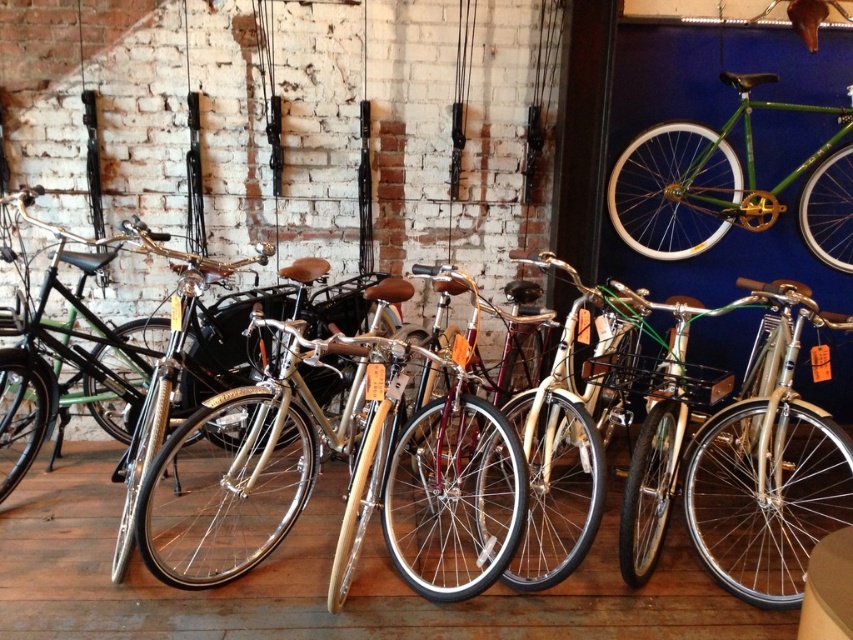
You are a customer in the bike shop and want to choose a bicycle that can be easily stored in your small apartment. Considering the height of the shiny silver bicycle at center and the shiny gold bicycle at center, which one would you recommend?

The shiny gold bicycle at center is shorter in height compared to the shiny silver bicycle at center, so it would be easier to store in a small apartment.

You are standing at the entrance of the bike shop and want to locate the shiny gold bicycle at center. According to the coordinates provided, where should you look in the image?

The shiny gold bicycle at center is located at point coordinates of [432,486] in the image.

You are a customer in the bike shop looking to purchase a bicycle. You notice the shiny silver bicycle at center and the green matte bicycle at upper right. Which bicycle is taller?

The shiny silver bicycle at center is taller than the green matte bicycle at upper right according to the description.